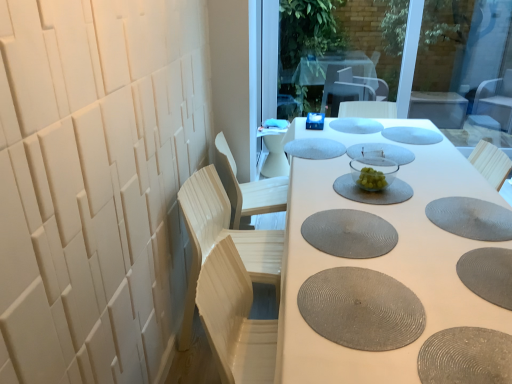
The width and height of the screenshot is (512, 384). What are the coordinates of `free space in front of blue fabric cushion at center, the first manhole cover in the back-to-front sequence` in the screenshot? It's located at (349, 136).